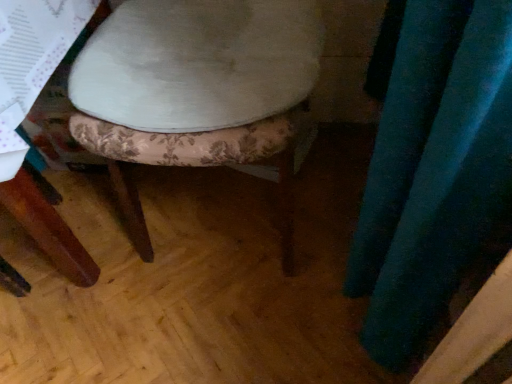
Locate an element on the screen. The width and height of the screenshot is (512, 384). velvet teal curtain at right is located at coordinates (431, 164).

What do you see at coordinates (431, 164) in the screenshot?
I see `velvet teal curtain at right` at bounding box center [431, 164].

This screenshot has height=384, width=512. Identify the location of velvet floral-patterned stool at center. click(217, 89).

The image size is (512, 384). What do you see at coordinates (217, 89) in the screenshot?
I see `velvet floral-patterned stool at center` at bounding box center [217, 89].

Measure the distance between point (179, 5) and camera.

A distance of 33.62 inches exists between point (179, 5) and camera.

Locate an element on the screen. This screenshot has width=512, height=384. velvet teal curtain at right is located at coordinates (431, 164).

Which object is positioned more to the right, velvet floral-patterned stool at center or velvet teal curtain at right?

From the viewer's perspective, velvet teal curtain at right appears more on the right side.

Looking at this image, which object is closer to the camera, velvet floral-patterned stool at center or velvet teal curtain at right?

Positioned in front is velvet teal curtain at right.

Which is farther, (175, 141) or (485, 40)?

The point (175, 141) is farther.

From the image's perspective, relative to velvet teal curtain at right, is velvet floral-patterned stool at center above or below?

Based on their image positions, velvet floral-patterned stool at center is located above velvet teal curtain at right.

From a real-world perspective, who is located higher, velvet floral-patterned stool at center or velvet teal curtain at right?

velvet teal curtain at right, from a real-world perspective.

Which object is wider, velvet floral-patterned stool at center or velvet teal curtain at right?

Wider between the two is velvet floral-patterned stool at center.

Considering the sizes of velvet floral-patterned stool at center and velvet teal curtain at right in the image, is velvet floral-patterned stool at center taller or shorter than velvet teal curtain at right?

velvet floral-patterned stool at center is taller than velvet teal curtain at right.

Considering the sizes of objects velvet floral-patterned stool at center and velvet teal curtain at right in the image provided, who is smaller, velvet floral-patterned stool at center or velvet teal curtain at right?

With smaller size is velvet teal curtain at right.

Is velvet floral-patterned stool at center not within velvet teal curtain at right?

Yes, velvet floral-patterned stool at center is outside of velvet teal curtain at right.

Is velvet floral-patterned stool at center not close to velvet teal curtain at right?

They are positioned close to each other.

Is velvet floral-patterned stool at center oriented away from velvet teal curtain at right?

No, velvet floral-patterned stool at center's orientation is not away from velvet teal curtain at right.

The height and width of the screenshot is (384, 512). In order to click on stool that is behind the velvet teal curtain at right in this screenshot , I will do `click(217, 89)`.

Between velvet teal curtain at right and velvet floral-patterned stool at center, which one appears on the left side from the viewer's perspective?

velvet floral-patterned stool at center.

Considering the relative positions of velvet teal curtain at right and velvet floral-patterned stool at center in the image provided, is velvet teal curtain at right in front of velvet floral-patterned stool at center?

Yes, velvet teal curtain at right is in front of velvet floral-patterned stool at center.

Considering the positions of points (481, 119) and (302, 50), is point (481, 119) farther from camera compared to point (302, 50)?

No, (481, 119) is closer to viewer.

From the image's perspective, which is above, velvet teal curtain at right or velvet floral-patterned stool at center?

velvet floral-patterned stool at center appears higher in the image.

From a real-world perspective, is velvet teal curtain at right located higher than velvet floral-patterned stool at center?

Yes.

Which of these two, velvet teal curtain at right or velvet floral-patterned stool at center, is wider?

With larger width is velvet floral-patterned stool at center.

Considering the relative sizes of velvet teal curtain at right and velvet floral-patterned stool at center in the image provided, is velvet teal curtain at right taller than velvet floral-patterned stool at center?

No.

Who is smaller, velvet teal curtain at right or velvet floral-patterned stool at center?

velvet teal curtain at right.

Is velvet teal curtain at right not within velvet floral-patterned stool at center?

Yes, velvet teal curtain at right is outside of velvet floral-patterned stool at center.

Are velvet teal curtain at right and velvet floral-patterned stool at center far apart?

No, velvet teal curtain at right is in close proximity to velvet floral-patterned stool at center.

Could you tell me if velvet teal curtain at right is turned towards velvet floral-patterned stool at center?

No.

Can you tell me how much velvet teal curtain at right and velvet floral-patterned stool at center differ in facing direction?

The facing directions of velvet teal curtain at right and velvet floral-patterned stool at center are 89.1 degrees apart.

Where is `curtain in front of the velvet floral-patterned stool at center`? curtain in front of the velvet floral-patterned stool at center is located at coordinates (431, 164).

The image size is (512, 384). I want to click on curtain above the velvet floral-patterned stool at center (from a real-world perspective), so click(x=431, y=164).

You are a GUI agent. You are given a task and a screenshot of the screen. Output one action in this format:
    pyautogui.click(x=<x>, y=<y>)
    Task: Click on the curtain in front of the velvet floral-patterned stool at center
    The width and height of the screenshot is (512, 384).
    Given the screenshot: What is the action you would take?
    pyautogui.click(x=431, y=164)